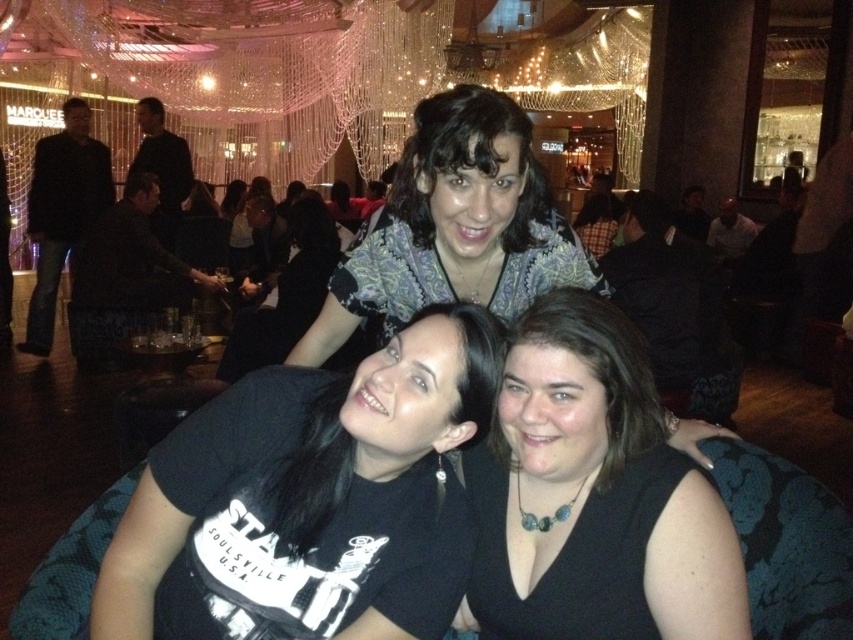
Question: Among these points, which one is nearest to the camera?

Choices:
 (A) (289, 234)
 (B) (36, 173)
 (C) (524, 268)

Answer: (C)

Question: Is black matte t-shirt at center bigger than black matte dress at center?

Choices:
 (A) yes
 (B) no

Answer: (A)

Question: Considering the relative positions of patterned fabric blouse at upper center and black leather jacket at left in the image provided, where is patterned fabric blouse at upper center located with respect to black leather jacket at left?

Choices:
 (A) above
 (B) below

Answer: (B)

Question: Which object is the farthest from the patterned fabric blouse at upper center?

Choices:
 (A) patterned fabric scarf at upper center
 (B) matte black shirt at center

Answer: (B)

Question: Which object is positioned closest to the black leather jacket at left?

Choices:
 (A) patterned fabric scarf at upper center
 (B) patterned fabric blouse at upper center

Answer: (A)

Question: Does black matte dress at center appear over patterned fabric blouse at upper center?

Choices:
 (A) no
 (B) yes

Answer: (A)